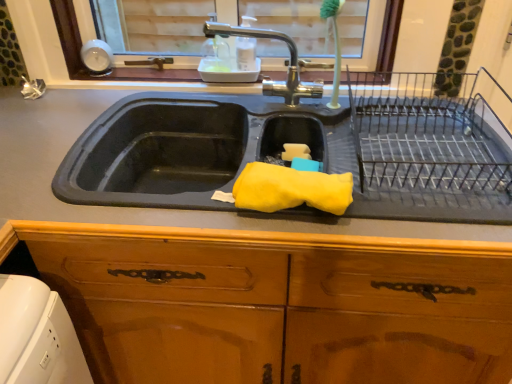
Question: Should I look upward or downward to see wooden cabinet at center?

Choices:
 (A) up
 (B) down

Answer: (B)

Question: Does wooden cabinet at center have a larger size compared to rubber yellow sponge at center?

Choices:
 (A) yes
 (B) no

Answer: (A)

Question: Considering the relative positions of wooden cabinet at center and rubber yellow sponge at center in the image provided, is wooden cabinet at center behind rubber yellow sponge at center?

Choices:
 (A) yes
 (B) no

Answer: (B)

Question: Could you tell me if wooden cabinet at center is turned towards rubber yellow sponge at center?

Choices:
 (A) no
 (B) yes

Answer: (B)

Question: From the image's perspective, is wooden cabinet at center over rubber yellow sponge at center?

Choices:
 (A) yes
 (B) no

Answer: (B)

Question: Can you confirm if wooden cabinet at center is thinner than rubber yellow sponge at center?

Choices:
 (A) no
 (B) yes

Answer: (A)

Question: Is wooden cabinet at center shorter than rubber yellow sponge at center?

Choices:
 (A) yes
 (B) no

Answer: (B)

Question: Is yellow sponge at sink beside black wire rack at right?

Choices:
 (A) no
 (B) yes

Answer: (A)

Question: Is the depth of yellow sponge at sink less than that of black wire rack at right?

Choices:
 (A) no
 (B) yes

Answer: (A)

Question: Is yellow sponge at sink taller than black wire rack at right?

Choices:
 (A) no
 (B) yes

Answer: (A)

Question: Could you tell me if yellow sponge at sink is facing black wire rack at right?

Choices:
 (A) yes
 (B) no

Answer: (B)

Question: Is there a large distance between yellow sponge at sink and black wire rack at right?

Choices:
 (A) yes
 (B) no

Answer: (B)

Question: Does yellow sponge at sink have a lesser width compared to black wire rack at right?

Choices:
 (A) yes
 (B) no

Answer: (A)

Question: From the image's perspective, is rubber yellow sponge at center beneath polished chrome faucet at upper center?

Choices:
 (A) no
 (B) yes

Answer: (B)